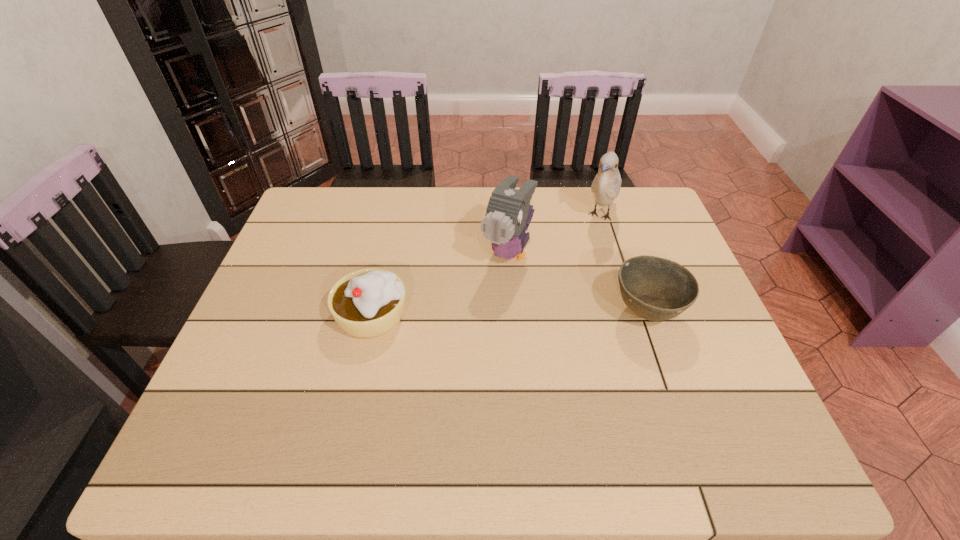
Select which object is the third closest to the leftmost object. Please provide its 2D coordinates. Your answer should be formatted as a tuple, i.e. [(x, y)], where the tuple contains the x and y coordinates of a point satisfying the conditions above.

[(606, 185)]